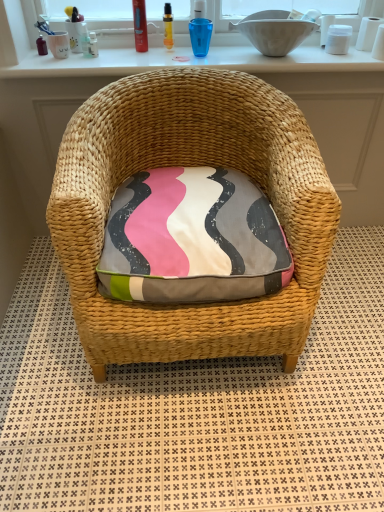
Identify the location of vacant space in front of translucent plastic toothbrush at upper center, the third toiletry when ordered from right to left. This screenshot has height=512, width=384. (87, 64).